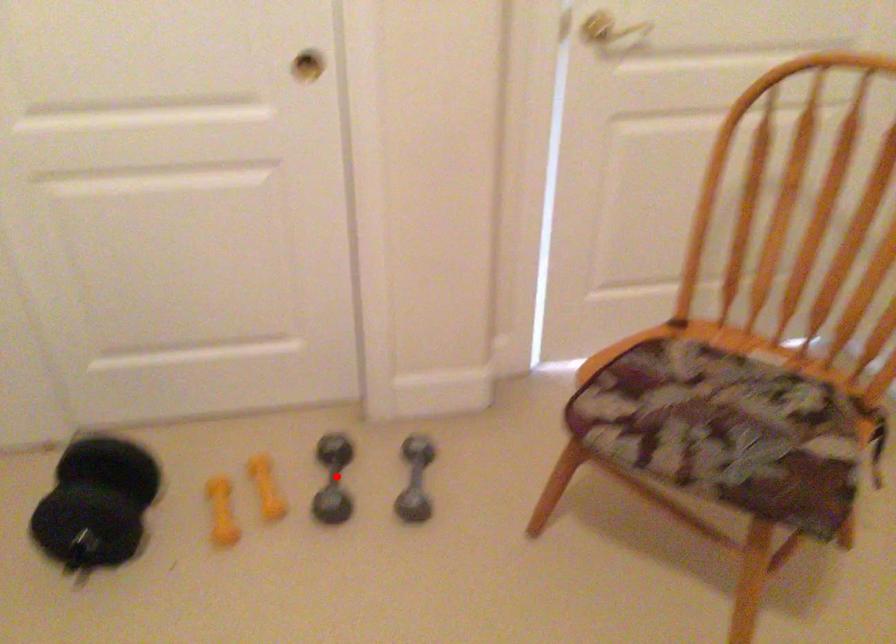
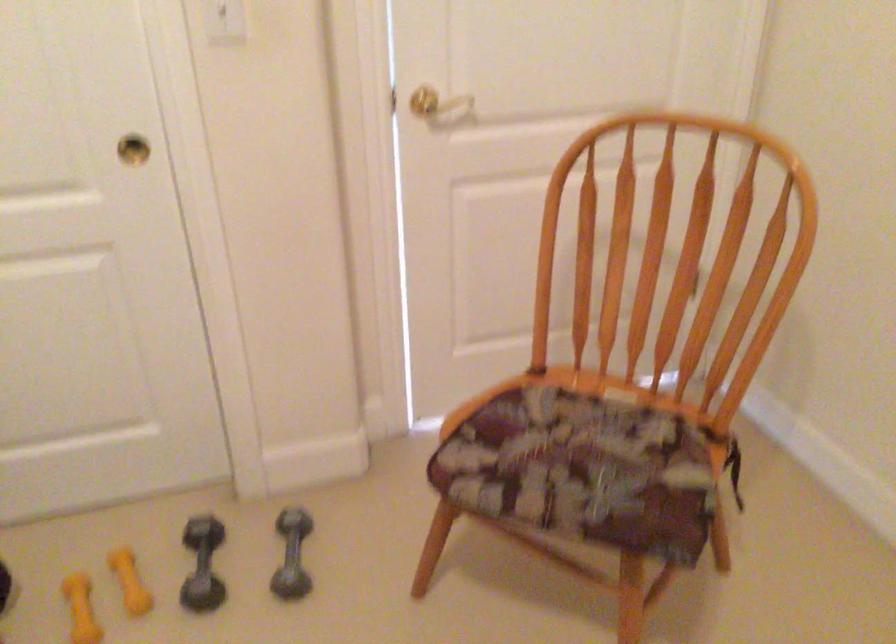
In the second image, find the point that corresponds to the highlighted location in the first image.

(202, 565)